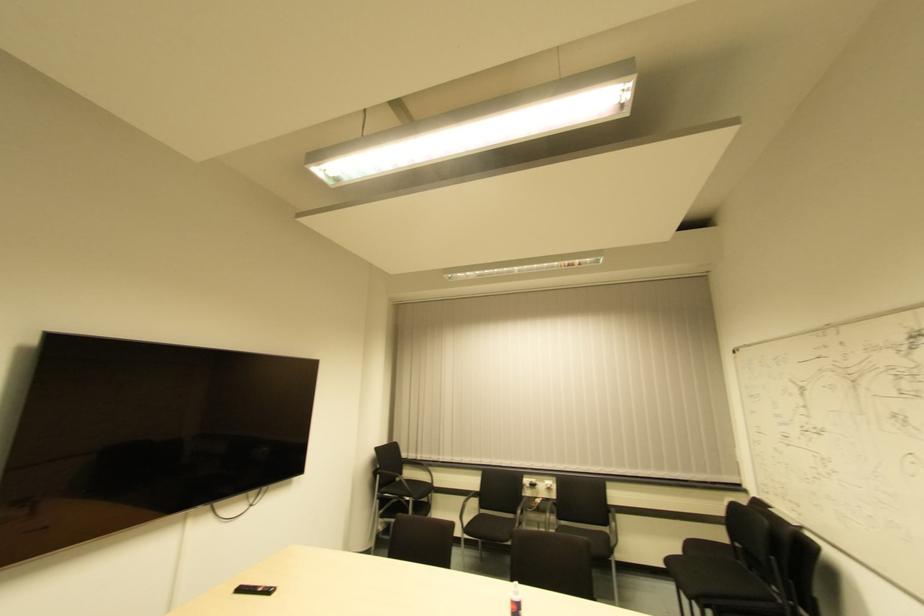
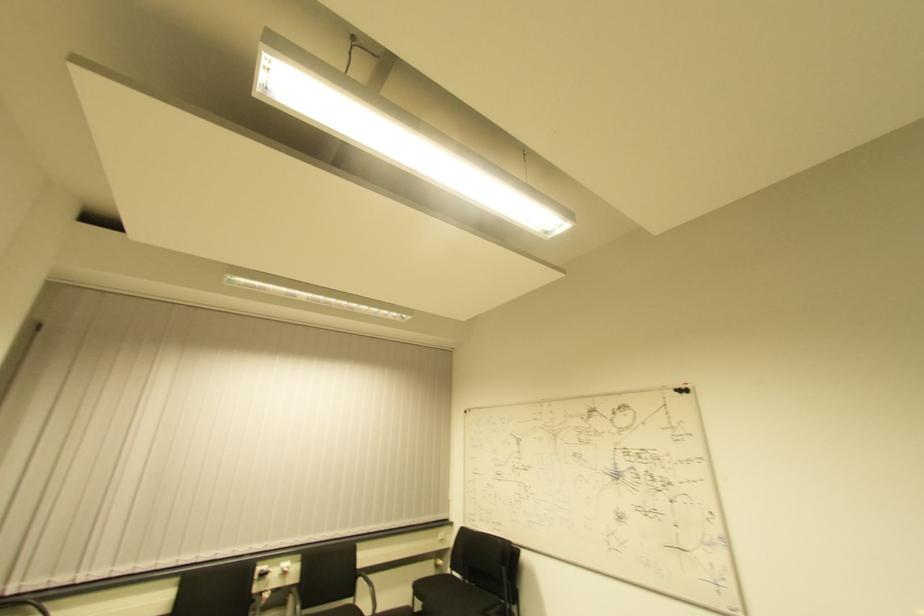
Where in the second image is the point corresponding to [424,467] from the first image?

(37, 601)